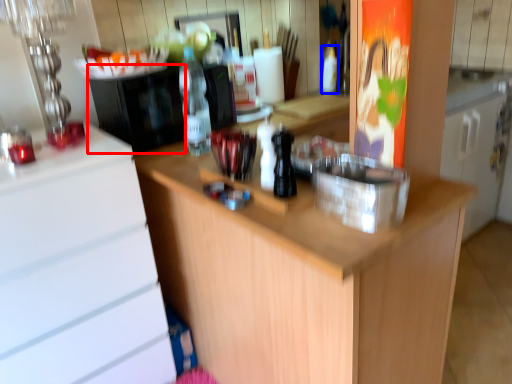
Question: Which object is closer to the camera taking this photo, appliance (highlighted by a red box) or bottle (highlighted by a blue box)?

Choices:
 (A) appliance
 (B) bottle

Answer: (A)